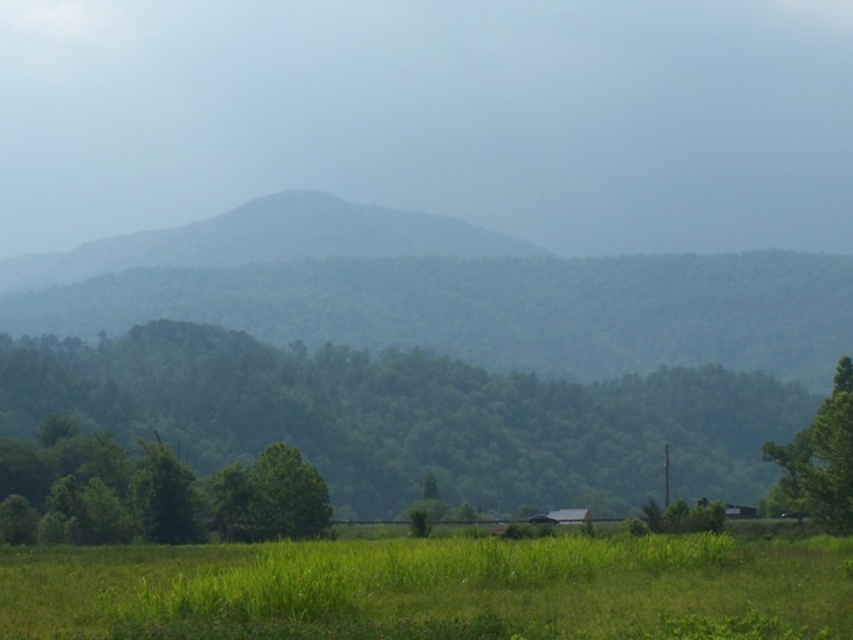
You are a gardener planning to plant a new row of flowers between the green grass at lower center and the green leafy tree at lower left. Based on their sizes, which area would be more suitable for planting a wider variety of flowers?

The green grass at lower center has a larger width than the green leafy tree at lower left, making it more suitable for planting a wider variety of flowers.

You are an artist setting up your easel in the middle of the grassy field. You want to paint both the green leafy tree at center and the green leafy tree at right. Which tree should you move closer to if you want both trees to appear equally sized in your painting?

You should move closer to the green leafy tree at right because it is smaller in reality. By moving closer to it, you can make it appear larger in your painting, balancing its size with the bigger green leafy tree at center.